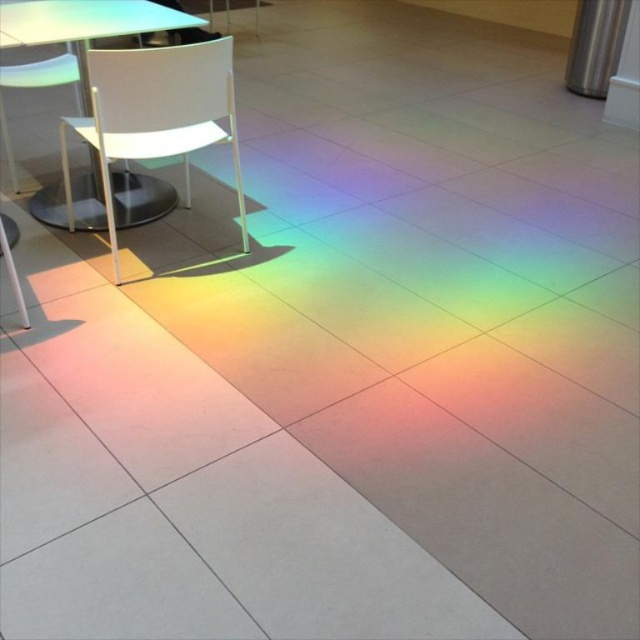
Does white plastic chair at upper left have a lesser height compared to white plastic table at upper left?

Correct, white plastic chair at upper left is not as tall as white plastic table at upper left.

Describe the element at coordinates (156, 115) in the screenshot. I see `white plastic chair at upper left` at that location.

Find the location of a particular element. This screenshot has height=640, width=640. white plastic chair at upper left is located at coordinates (156, 115).